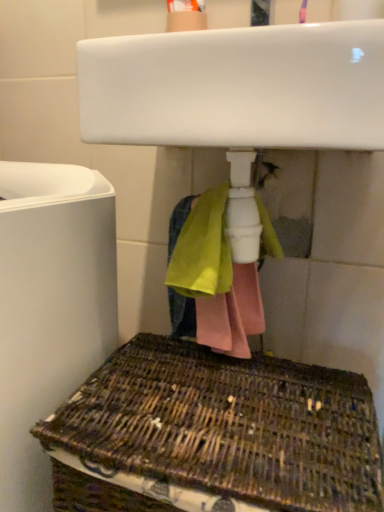
I want to click on white matte toilet at left, so click(x=50, y=307).

Consider the image. In order to face woven brown basket at lower center, should I rotate leftwards or rightwards?

To align with it, rotate right about 3.692°.

The image size is (384, 512). Describe the element at coordinates (237, 96) in the screenshot. I see `white glossy sink at upper center` at that location.

Identify the location of white glossy sink at upper center. (237, 96).

Identify the location of white matte toilet at left. (50, 307).

Is white matte toilet at left beside woven brown basket at lower center?

No, white matte toilet at left is not making contact with woven brown basket at lower center.

Where is `basket in front of the white matte toilet at left`? The image size is (384, 512). basket in front of the white matte toilet at left is located at coordinates (214, 434).

Is point (141, 76) closer or farther from the camera than point (18, 496)?

Clearly, point (141, 76) is closer to the camera than point (18, 496).

From the image's perspective, is white glossy sink at upper center positioned above or below white matte toilet at left?

From the image's perspective, white glossy sink at upper center appears above white matte toilet at left.

In the scene shown: From a real-world perspective, who is located higher, white glossy sink at upper center or white matte toilet at left?

From a 3D spatial view, white glossy sink at upper center is above.

Is woven brown basket at lower center at the back of white glossy sink at upper center?

white glossy sink at upper center is not turned away from woven brown basket at lower center.

Can you confirm if white glossy sink at upper center is thinner than woven brown basket at lower center?

Correct, the width of white glossy sink at upper center is less than that of woven brown basket at lower center.

Would you say white glossy sink at upper center is outside woven brown basket at lower center?

Absolutely, white glossy sink at upper center is external to woven brown basket at lower center.

Is white glossy sink at upper center at the right side of woven brown basket at lower center?

Yes, white glossy sink at upper center is to the right of woven brown basket at lower center.

Can you confirm if woven brown basket at lower center is positioned to the right of white glossy sink at upper center?

No.

Could you tell me if woven brown basket at lower center is turned towards white glossy sink at upper center?

No.

Considering the points (310, 377) and (222, 53), which point is behind, point (310, 377) or point (222, 53)?

The point (310, 377) is more distant.

Is white matte toilet at left at the back of woven brown basket at lower center?

No, woven brown basket at lower center's orientation is not away from white matte toilet at left.

From the image's perspective, is woven brown basket at lower center on white matte toilet at left?

No.

Considering the positions of point (116, 414) and point (44, 345), is point (116, 414) closer or farther from the camera than point (44, 345)?

Point (116, 414).

Can you see woven brown basket at lower center touching white matte toilet at left?

No, woven brown basket at lower center is not next to white matte toilet at left.

Is white matte toilet at left behind white glossy sink at upper center?

Yes, it is.

Does white matte toilet at left have a greater height compared to white glossy sink at upper center?

Yes, white matte toilet at left is taller than white glossy sink at upper center.

Is white matte toilet at left positioned with its back to white glossy sink at upper center?

No.

From the picture: Looking at the image, does white matte toilet at left seem bigger or smaller compared to white glossy sink at upper center?

Clearly, white matte toilet at left is larger in size than white glossy sink at upper center.

The image size is (384, 512). Identify the location of basket in front of the white matte toilet at left. (214, 434).

There is a white matte toilet at left. Identify the location of sink above it (from a real-world perspective). (237, 96).

From the image, which object appears to be farther from woven brown basket at lower center, white matte toilet at left or white glossy sink at upper center?

white glossy sink at upper center.

Consider the image. Based on their spatial positions, is woven brown basket at lower center or white matte toilet at left closer to white glossy sink at upper center?

white matte toilet at left lies closer to white glossy sink at upper center than the other object.

From the image, which object appears to be farther from white matte toilet at left, woven brown basket at lower center or white glossy sink at upper center?

white glossy sink at upper center is positioned further to the anchor white matte toilet at left.

Looking at the image, which one is located closer to woven brown basket at lower center, white glossy sink at upper center or white matte toilet at left?

white matte toilet at left lies closer to woven brown basket at lower center than the other object.

From the image, which object appears to be nearer to white matte toilet at left, white glossy sink at upper center or woven brown basket at lower center?

woven brown basket at lower center is positioned closer to the anchor white matte toilet at left.

Based on their spatial positions, is white matte toilet at left or woven brown basket at lower center further from white glossy sink at upper center?

Among the two, woven brown basket at lower center is located further to white glossy sink at upper center.

Identify the location of appliance between white glossy sink at upper center and woven brown basket at lower center in the vertical direction. Image resolution: width=384 pixels, height=512 pixels. (50, 307).